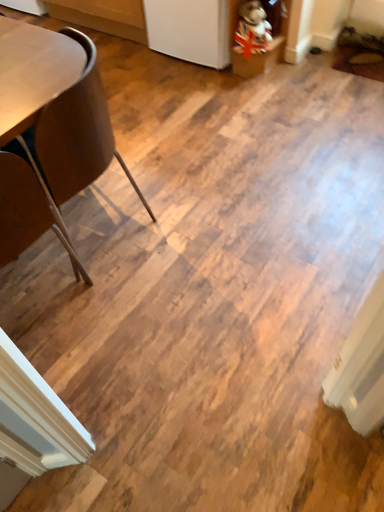
Question: Would you say brown leather chair at left, acting as the 2th chair starting from the top, is outside brown leather chair at left, which is counted as the 1th chair, starting from the top?

Choices:
 (A) no
 (B) yes

Answer: (B)

Question: Does brown leather chair at left, acting as the 2th chair starting from the top, come behind brown leather chair at left, which is counted as the 1th chair, starting from the top?

Choices:
 (A) no
 (B) yes

Answer: (A)

Question: Considering the relative sizes of brown leather chair at left, which is counted as the first chair, starting from the bottom, and brown leather chair at left, which is counted as the 1th chair, starting from the top, in the image provided, is brown leather chair at left, which is counted as the first chair, starting from the bottom, wider than brown leather chair at left, which is counted as the 1th chair, starting from the top,?

Choices:
 (A) yes
 (B) no

Answer: (B)

Question: Can you confirm if brown leather chair at left, which is counted as the first chair, starting from the bottom, is bigger than brown leather chair at left, which is counted as the 1th chair, starting from the top?

Choices:
 (A) yes
 (B) no

Answer: (B)

Question: Is brown leather chair at left, which is counted as the first chair, starting from the bottom, placed right next to brown leather chair at left, which is counted as the 1th chair, starting from the top?

Choices:
 (A) yes
 (B) no

Answer: (B)

Question: In the image, is brown leather chair at left, acting as the 2th chair starting from the top, on the left side or the right side of brown leather chair at left, which is counted as the 1th chair, starting from the top?

Choices:
 (A) left
 (B) right

Answer: (A)

Question: In terms of height, does brown leather chair at left, acting as the 2th chair starting from the top, look taller or shorter compared to brown leather chair at left, which is counted as the 1th chair, starting from the top?

Choices:
 (A) tall
 (B) short

Answer: (B)

Question: Is point (29, 217) closer or farther from the camera than point (104, 161)?

Choices:
 (A) closer
 (B) farther

Answer: (A)

Question: Is brown leather chair at left, acting as the 2th chair starting from the top, spatially inside brown leather chair at left, which is counted as the 1th chair, starting from the top, or outside of it?

Choices:
 (A) inside
 (B) outside

Answer: (B)

Question: Based on their sizes in the image, would you say union jack plush at upper right is bigger or smaller than brown leather chair at left, which is counted as the first chair, starting from the bottom?

Choices:
 (A) small
 (B) big

Answer: (A)

Question: Relative to brown leather chair at left, which is counted as the first chair, starting from the bottom, is union jack plush at upper right in front or behind?

Choices:
 (A) front
 (B) behind

Answer: (B)

Question: Considering the relative positions of union jack plush at upper right and brown leather chair at left, which is counted as the first chair, starting from the bottom, in the image provided, is union jack plush at upper right to the left or to the right of brown leather chair at left, which is counted as the first chair, starting from the bottom,?

Choices:
 (A) left
 (B) right

Answer: (B)

Question: From a real-world perspective, is union jack plush at upper right above or below brown leather chair at left, which is counted as the first chair, starting from the bottom?

Choices:
 (A) above
 (B) below

Answer: (B)

Question: Based on their positions, is union jack plush at upper right located to the left or right of brown leather chair at left, which is counted as the 1th chair, starting from the top?

Choices:
 (A) left
 (B) right

Answer: (B)

Question: Is point (258, 13) closer or farther from the camera than point (74, 92)?

Choices:
 (A) closer
 (B) farther

Answer: (B)